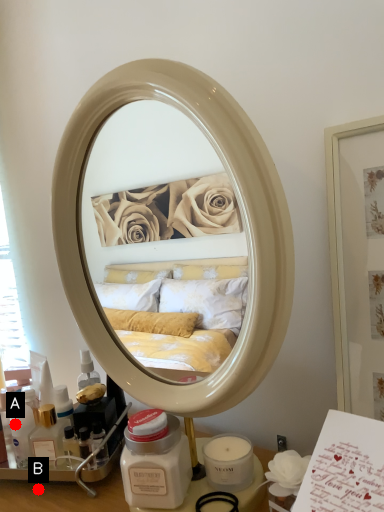
Question: Two points are circled on the image, labeled by A and B beside each circle. Which point is closer to the camera?

Choices:
 (A) A is closer
 (B) B is closer

Answer: (B)